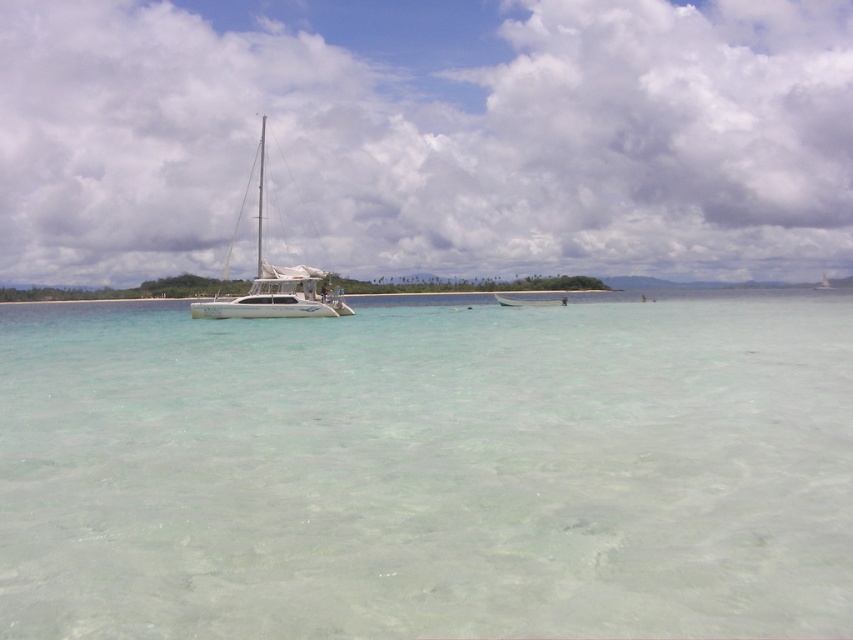
Question: Is clear water at center above green plastic boat at center?

Choices:
 (A) yes
 (B) no

Answer: (B)

Question: From the image, what is the correct spatial relationship of white glossy sailboat at center in relation to green plastic boat at center?

Choices:
 (A) right
 (B) left

Answer: (B)

Question: Among these points, which one is nearest to the camera?

Choices:
 (A) (524, 300)
 (B) (270, 268)
 (C) (28, 397)

Answer: (C)

Question: Based on their relative distances, which object is farther from the white glossy sailboat at center?

Choices:
 (A) green plastic boat at center
 (B) clear water at center

Answer: (A)

Question: Does clear water at center appear over white glossy sailboat at center?

Choices:
 (A) no
 (B) yes

Answer: (A)

Question: Among these points, which one is farthest from the camera?

Choices:
 (A) (785, 440)
 (B) (213, 317)

Answer: (B)